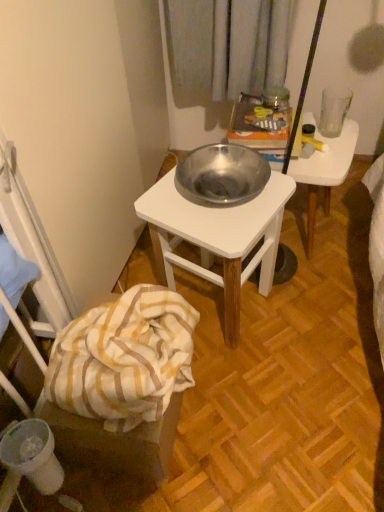
Locate an element on the screen. This screenshot has height=512, width=384. vacant space in front of metallic silver bowl at center is located at coordinates (316, 293).